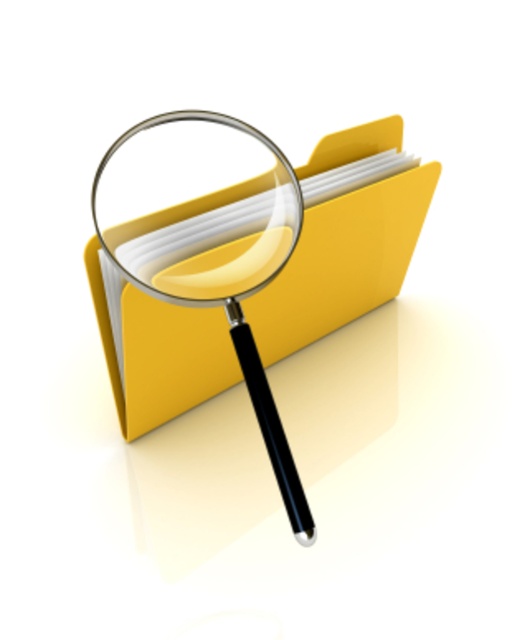
Does transparent plastic magnifying glass at center have a greater height compared to transparent glass magnifying glass at center?

Yes.

Can you confirm if transparent plastic magnifying glass at center is wider than transparent glass magnifying glass at center?

Yes.

What do you see at coordinates (202, 243) in the screenshot? I see `transparent plastic magnifying glass at center` at bounding box center [202, 243].

Where is `transparent plastic magnifying glass at center`? transparent plastic magnifying glass at center is located at coordinates (202, 243).